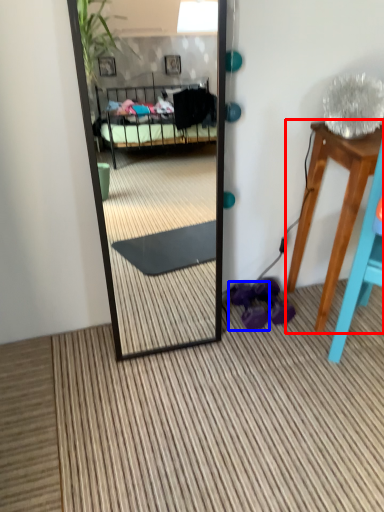
Question: Which object is closer to the camera taking this photo, table (highlighted by a red box) or shoe (highlighted by a blue box)?

Choices:
 (A) table
 (B) shoe

Answer: (A)